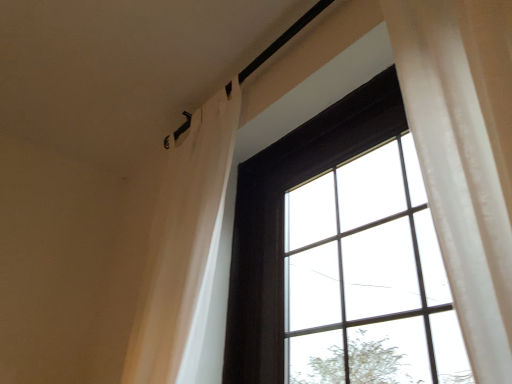
Question: From the image's perspective, is matte black window at center above or below white sheer curtain at upper left?

Choices:
 (A) below
 (B) above

Answer: (A)

Question: Considering the positions of matte black window at center and white sheer curtain at upper left in the image, is matte black window at center taller or shorter than white sheer curtain at upper left?

Choices:
 (A) short
 (B) tall

Answer: (A)

Question: Is matte black window at center to the left or to the right of white sheer curtain at upper left in the image?

Choices:
 (A) left
 (B) right

Answer: (B)

Question: Considering the positions of white sheer curtain at upper left and matte black window at center in the image, is white sheer curtain at upper left taller or shorter than matte black window at center?

Choices:
 (A) short
 (B) tall

Answer: (B)

Question: Considering the positions of white sheer curtain at upper left and matte black window at center in the image, is white sheer curtain at upper left wider or thinner than matte black window at center?

Choices:
 (A) thin
 (B) wide

Answer: (B)

Question: From a real-world perspective, is white sheer curtain at upper left physically located above or below matte black window at center?

Choices:
 (A) below
 (B) above

Answer: (B)

Question: Considering the positions of white sheer curtain at upper left and matte black window at center in the image, is white sheer curtain at upper left bigger or smaller than matte black window at center?

Choices:
 (A) small
 (B) big

Answer: (A)